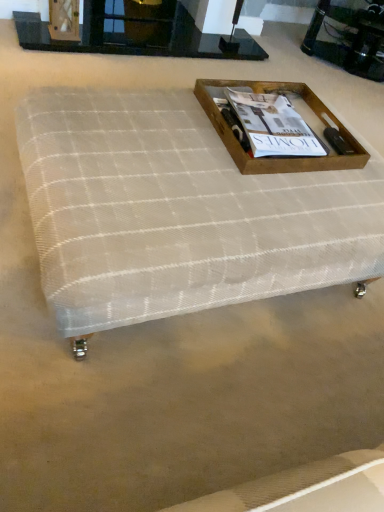
The height and width of the screenshot is (512, 384). What are the coordinates of `free space above white mesh ottoman at center (from a real-world perspective)` in the screenshot? It's located at 204,160.